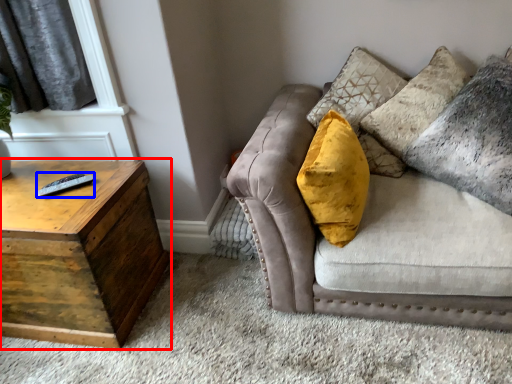
Question: Among these objects, which one is nearest to the camera, table (highlighted by a red box) or remote (highlighted by a blue box)?

Choices:
 (A) table
 (B) remote

Answer: (A)